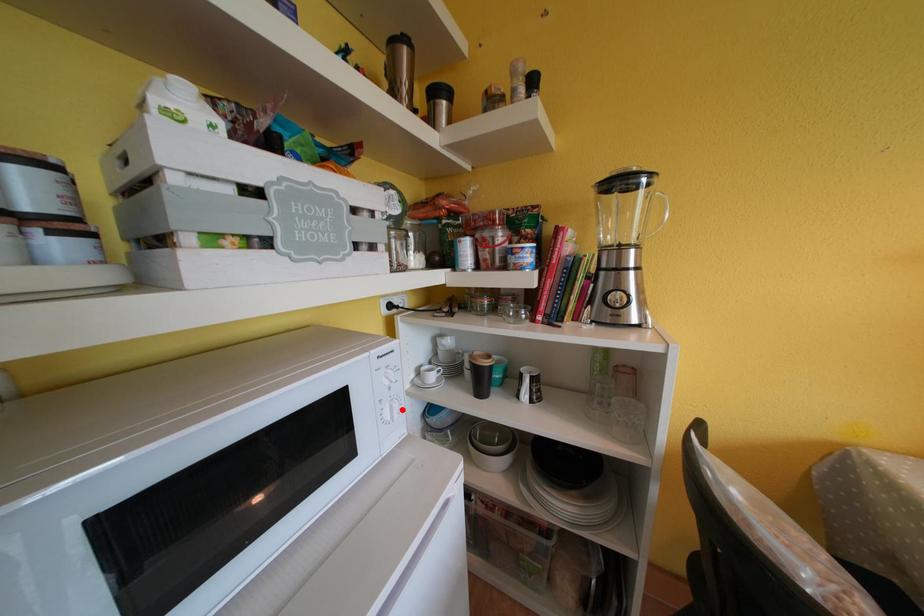
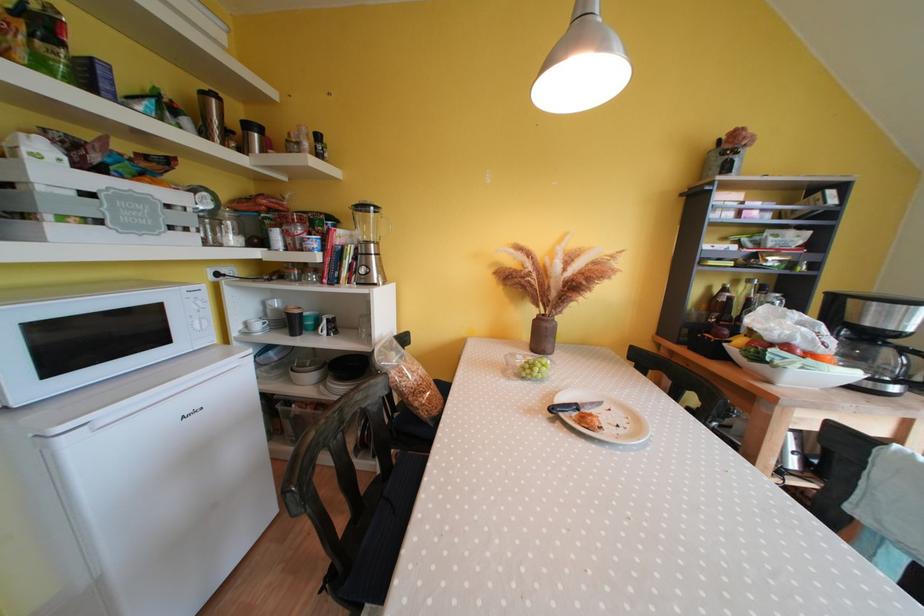
Find the pixel in the second image that matches the highlighted location in the first image.

(210, 325)